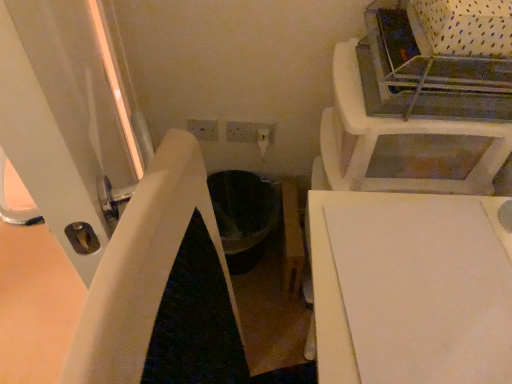
Locate an element on the screen. This screenshot has width=512, height=384. vacant space underneath white matte board at center (from a real-world perspective) is located at coordinates (434, 294).